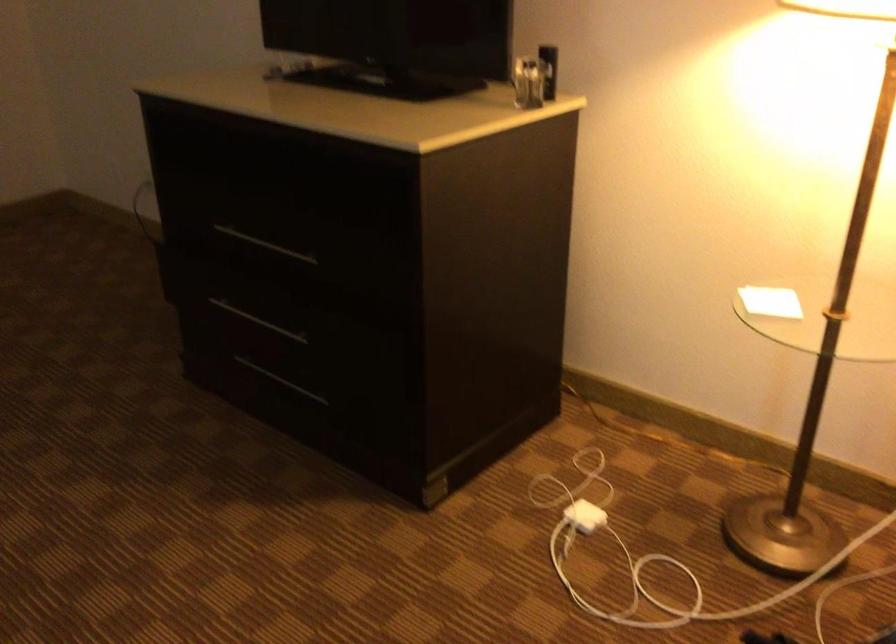
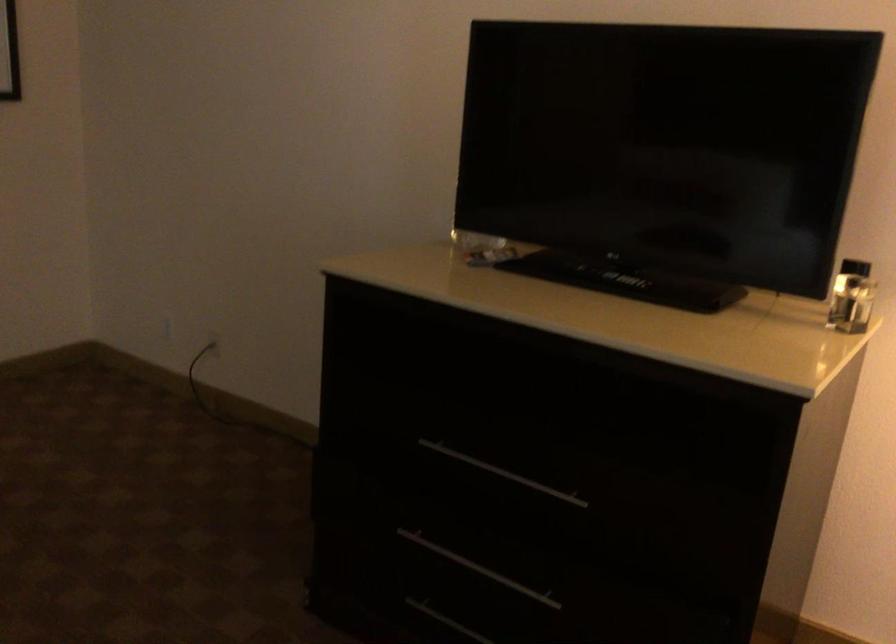
In the second image, find the point that corresponds to pixel 367 82 in the first image.

(625, 279)